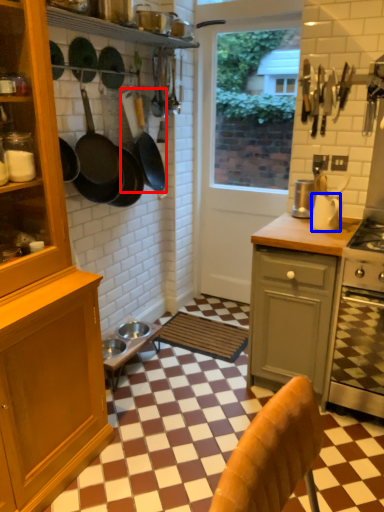
Question: Among these objects, which one is farthest to the camera, frying pan (highlighted by a red box) or kitchen appliance (highlighted by a blue box)?

Choices:
 (A) frying pan
 (B) kitchen appliance

Answer: (A)